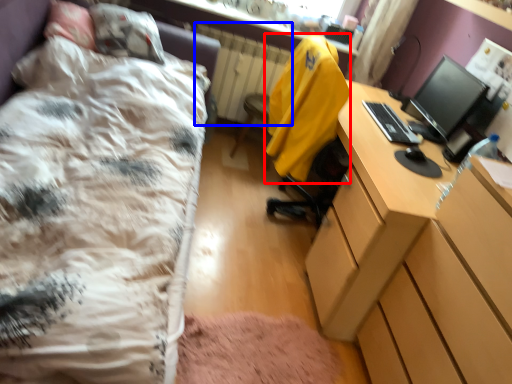
Question: Which of the following is the closest to the observer, jacket (highlighted by a red box) or radiator (highlighted by a blue box)?

Choices:
 (A) jacket
 (B) radiator

Answer: (A)